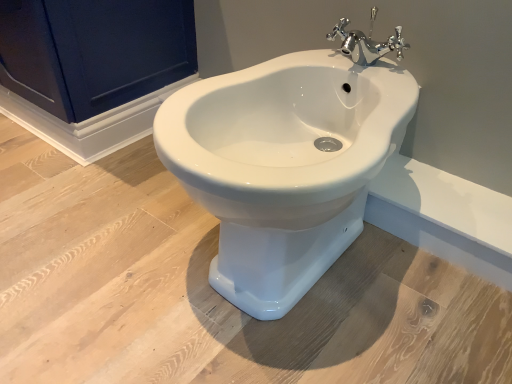
Question: From a real-world perspective, is chrome metallic faucet at upper center physically located above or below matte dark blue cabinet at upper left?

Choices:
 (A) below
 (B) above

Answer: (B)

Question: Relative to matte dark blue cabinet at upper left, is chrome metallic faucet at upper center in front or behind?

Choices:
 (A) behind
 (B) front

Answer: (B)

Question: Estimate the real-world distances between objects in this image. Which object is farther from the white glossy bidet at center?

Choices:
 (A) matte dark blue cabinet at upper left
 (B) chrome metallic faucet at upper center

Answer: (A)

Question: Estimate the real-world distances between objects in this image. Which object is farther from the matte dark blue cabinet at upper left?

Choices:
 (A) white glossy bidet at center
 (B) chrome metallic faucet at upper center

Answer: (A)